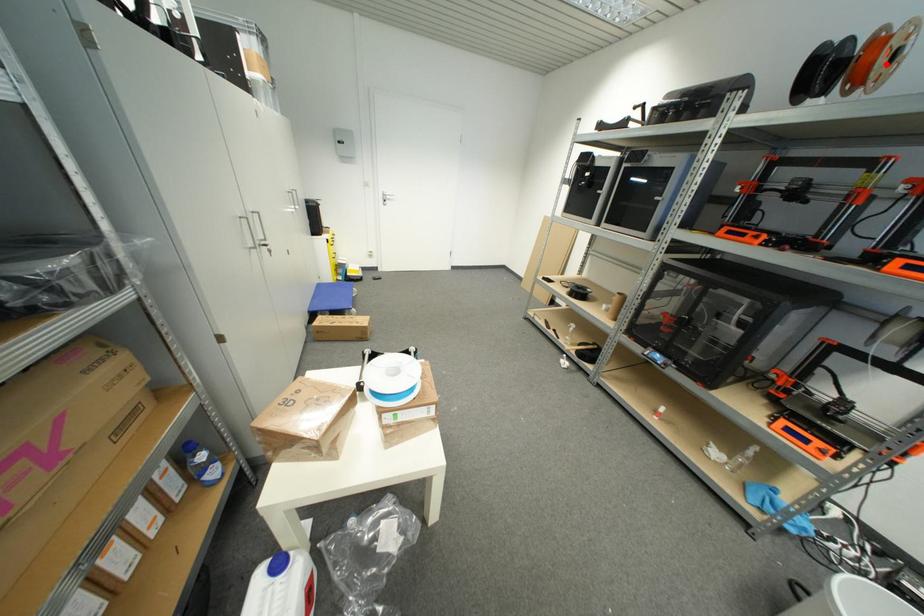
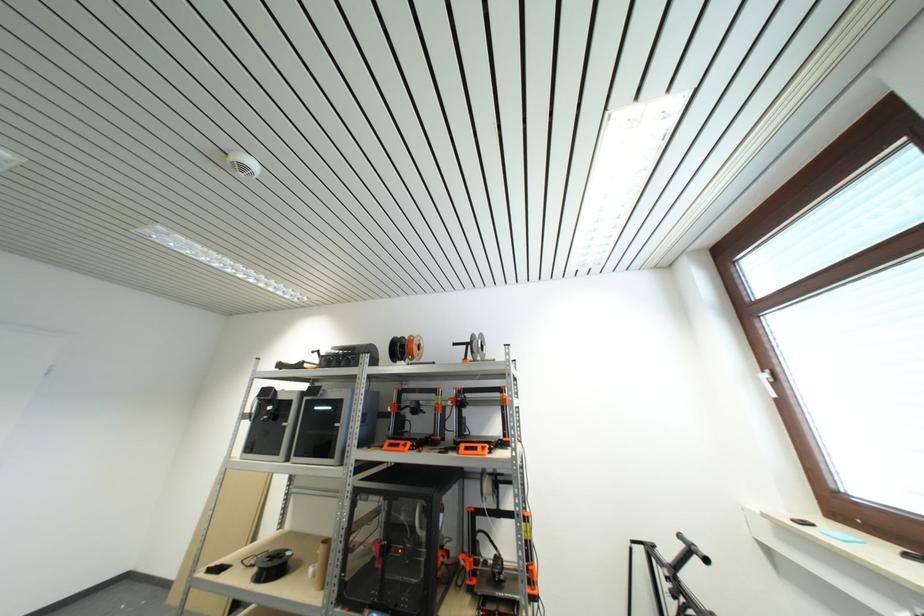
Question: I am providing you with two images of the same scene from different viewpoints. Given a red point in image1, look at the same physical point in image2. Is it:

Choices:
 (A) Closer to the viewpoint
 (B) Farther from the viewpoint

Answer: (A)